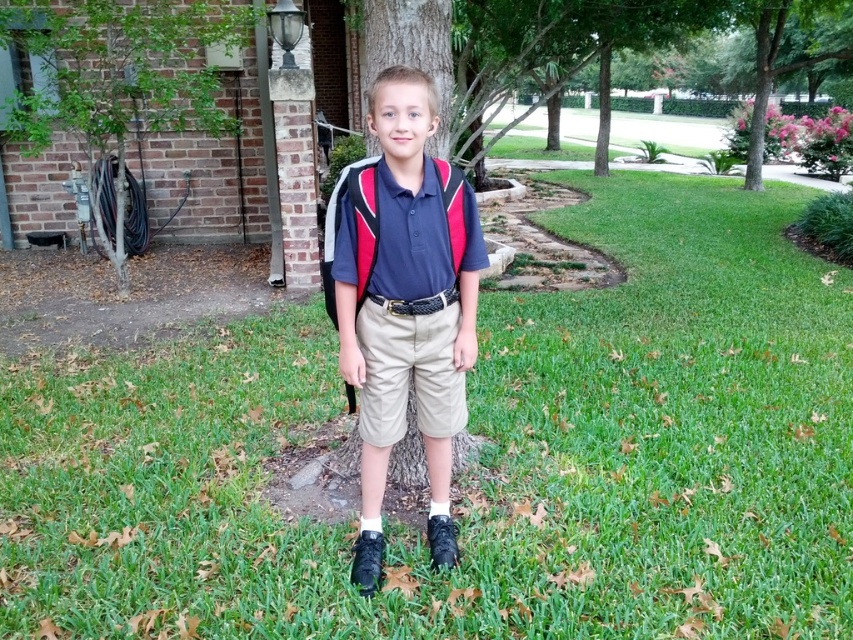
You are a photographer taking a picture of the boy in the scene. Which part of his clothing is more visible to you, the matte blue shirt at center or the khaki cotton shorts at center?

The matte blue shirt at center is closer to the viewer than the khaki cotton shorts at center, so the matte blue shirt at center is more visible.